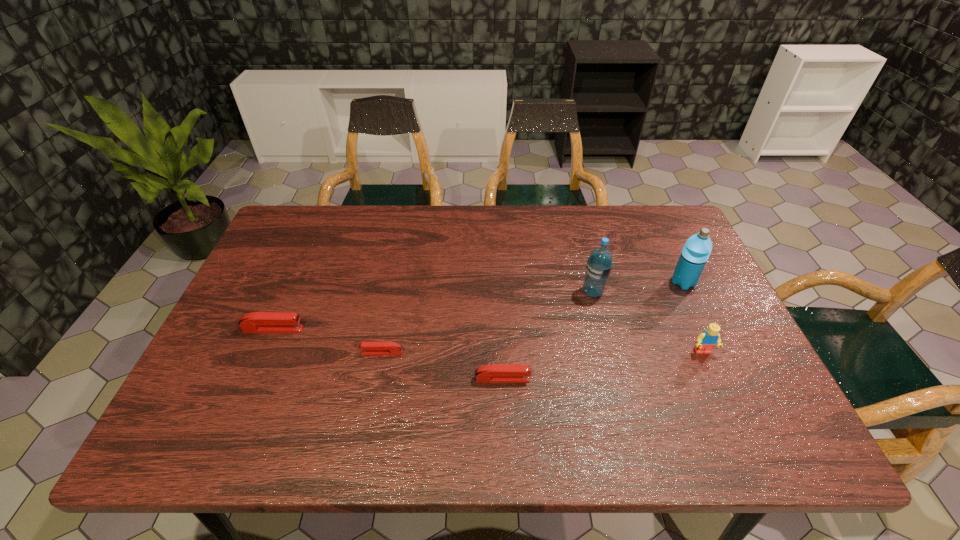
Where is `free spot located 0.190m on the front-facing side of the second stapler from right to left`? free spot located 0.190m on the front-facing side of the second stapler from right to left is located at coordinates (283, 353).

Locate an element on the screen. Image resolution: width=960 pixels, height=540 pixels. free space located 0.240m on the front-facing side of the second stapler from right to left is located at coordinates (263, 353).

I want to click on free space located on the front-facing side of the second stapler from right to left, so click(258, 353).

Identify the location of free space located on the front-facing side of the rightmost stapler. Image resolution: width=960 pixels, height=540 pixels. (682, 379).

You are a GUI agent. You are given a task and a screenshot of the screen. Output one action in this format:
    pyautogui.click(x=<x>, y=<y>)
    Task: Click on the free space located on the left of the thermos bottle
    
    Given the screenshot: What is the action you would take?
    pyautogui.click(x=562, y=282)

Locate an element on the screen. The image size is (960, 540). free space located 0.060m on the front-facing side of the fourth shortest object is located at coordinates (714, 379).

Where is `vacant space located on the back of the water bottle`? Image resolution: width=960 pixels, height=540 pixels. vacant space located on the back of the water bottle is located at coordinates (578, 233).

Locate an element on the screen. object that is at the near edge is located at coordinates (494, 373).

Where is `object positioned at the left edge`? This screenshot has width=960, height=540. object positioned at the left edge is located at coordinates (256, 322).

Image resolution: width=960 pixels, height=540 pixels. I want to click on thermos bottle that is at the right edge, so click(x=696, y=251).